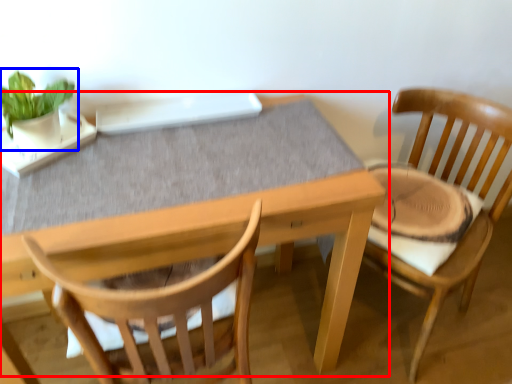
Question: Among these objects, which one is nearest to the camera, table (highlighted by a red box) or houseplant (highlighted by a blue box)?

Choices:
 (A) table
 (B) houseplant

Answer: (A)